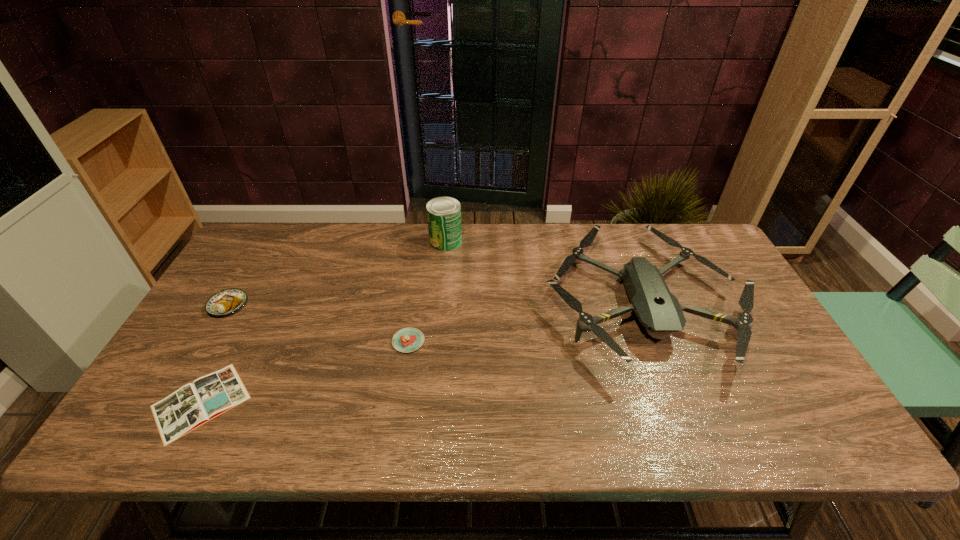
Locate an element on the screen. object positioned at the far right corner is located at coordinates (658, 310).

Identify the location of vacant region at the far edge of the desktop. This screenshot has height=540, width=960. (671, 260).

This screenshot has height=540, width=960. In order to click on free space at the near edge of the desktop in this screenshot , I will do `click(519, 443)`.

The image size is (960, 540). Identify the location of blank space at the left edge of the desktop. (243, 286).

You are a GUI agent. You are given a task and a screenshot of the screen. Output one action in this format:
    pyautogui.click(x=<x>, y=<y>)
    Task: Click on the vacant space at the right edge of the desktop
    
    Given the screenshot: What is the action you would take?
    pyautogui.click(x=782, y=387)

In the image, there is a desktop. At what (x,y) coordinates should I click in order to perform the action: click on vacant area at the far left corner. Please return your answer as a coordinate pair (x, y). The width and height of the screenshot is (960, 540). Looking at the image, I should click on (275, 254).

The width and height of the screenshot is (960, 540). I want to click on free space at the far right corner, so click(697, 244).

Locate an element on the screen. The image size is (960, 540). empty space between the tallest object and the rightmost object is located at coordinates (544, 270).

Locate an element on the screen. vacant space that is in between the right pastry and the drone is located at coordinates coord(525,320).

Where is `blank region between the shorter pastry and the tallest object`? Image resolution: width=960 pixels, height=540 pixels. blank region between the shorter pastry and the tallest object is located at coordinates (427, 291).